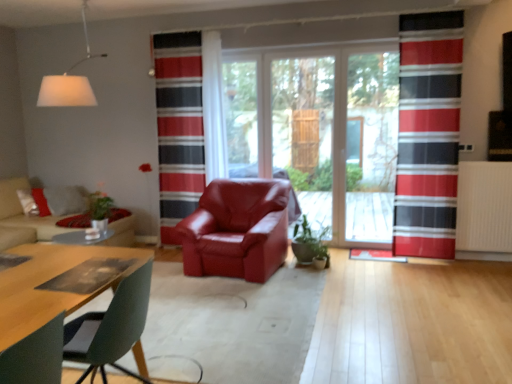
Question: From a real-world perspective, is green glossy plant at center physically located above or below transparent glass screen door at center, placed as the 2th screen door when sorted from right to left?

Choices:
 (A) below
 (B) above

Answer: (A)

Question: Considering their positions, is green glossy plant at center located in front of or behind transparent glass screen door at center, arranged as the first screen door when viewed from the left?

Choices:
 (A) front
 (B) behind

Answer: (A)

Question: Which object is the closest to the white matte lampshade at upper left?

Choices:
 (A) transparent glass screen door at center, placed as the 2th screen door when sorted from right to left
 (B) satin red armchair at center
 (C) green glossy plant at center
 (D) red striped curtain at right, which is the second curtain from left to right
 (E) white textured radiator at right

Answer: (B)

Question: Which of these objects is positioned farthest from the transparent glass screen door at center, which is counted as the first screen door, starting from the right?

Choices:
 (A) transparent glass window at center
 (B) red striped curtain at right, which is the second curtain from left to right
 (C) beige fabric couch at left
 (D) satin red armchair at center
 (E) white textured radiator at right

Answer: (C)